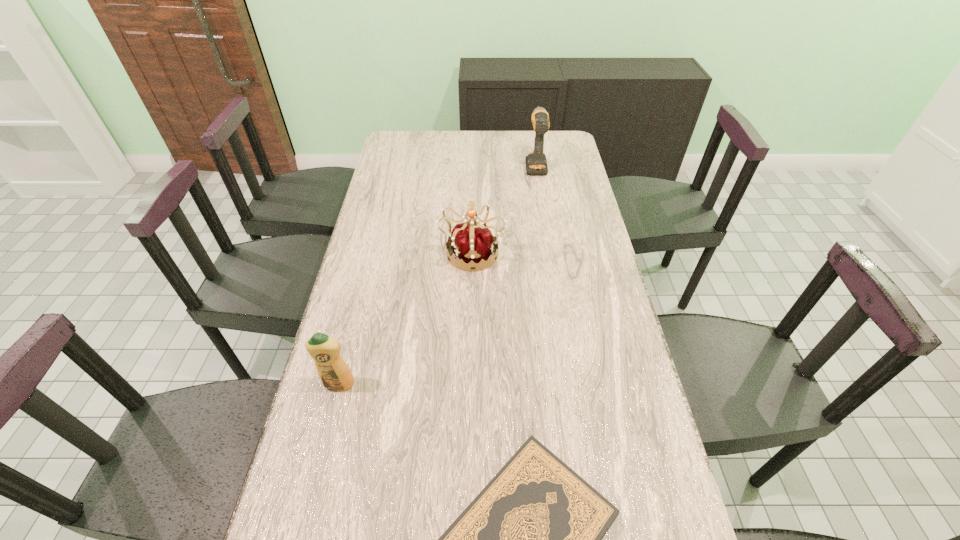
This screenshot has height=540, width=960. I want to click on object at the far right corner, so click(536, 163).

What are the coordinates of `free region at the far edge of the desktop` in the screenshot? It's located at (485, 139).

The height and width of the screenshot is (540, 960). Identify the location of free space at the left edge of the desktop. (378, 305).

The height and width of the screenshot is (540, 960). Find the location of `vacant space at the right edge of the desktop`. vacant space at the right edge of the desktop is located at coordinates (556, 181).

In the image, there is a desktop. Where is `vacant space at the far left corner`? Image resolution: width=960 pixels, height=540 pixels. vacant space at the far left corner is located at coordinates tap(419, 134).

Locate an element on the screen. vacant point located between the third farthest object and the third nearest object is located at coordinates (405, 318).

At what (x,y) coordinates should I click in order to perform the action: click on free space that is in between the detergent and the tiara. Please return your answer as a coordinate pair (x, y). Looking at the image, I should click on (405, 318).

Identify the location of vacant region between the drill and the third nearest object. This screenshot has height=540, width=960. (504, 208).

Locate an element on the screen. vacant space that's between the second farthest object and the farthest object is located at coordinates (504, 208).

Find the location of `vacant space that's between the third nearest object and the detergent`. vacant space that's between the third nearest object and the detergent is located at coordinates (405, 318).